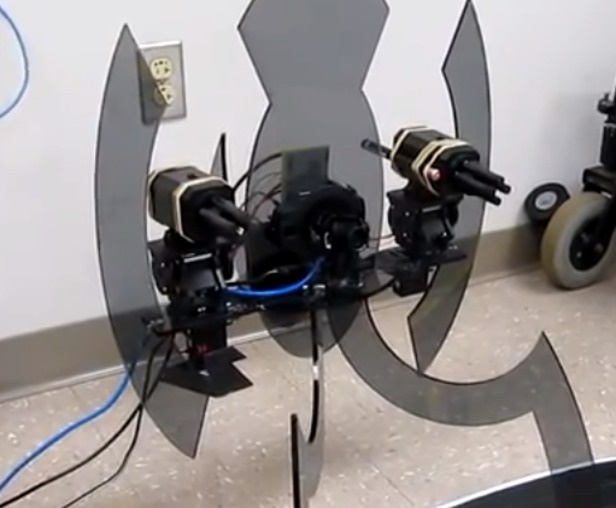
Where is `skirting board - brown`? skirting board - brown is located at coordinates (49, 339).